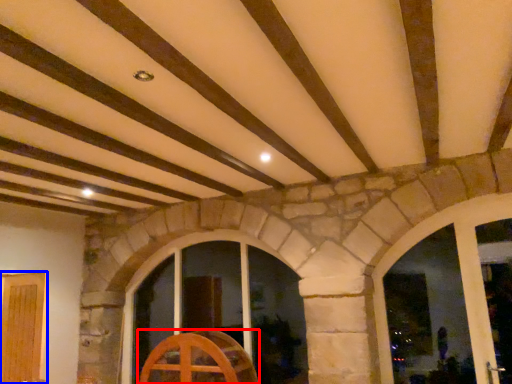
Question: Which of the following is the closest to the observer, furniture (highlighted by a red box) or door (highlighted by a blue box)?

Choices:
 (A) furniture
 (B) door

Answer: (B)